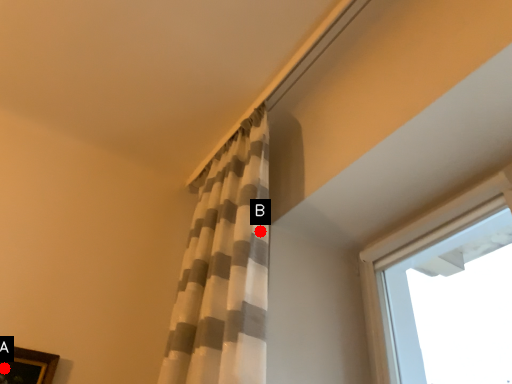
Question: Two points are circled on the image, labeled by A and B beside each circle. Which of the following is the closest to the observer?

Choices:
 (A) A is closer
 (B) B is closer

Answer: (B)